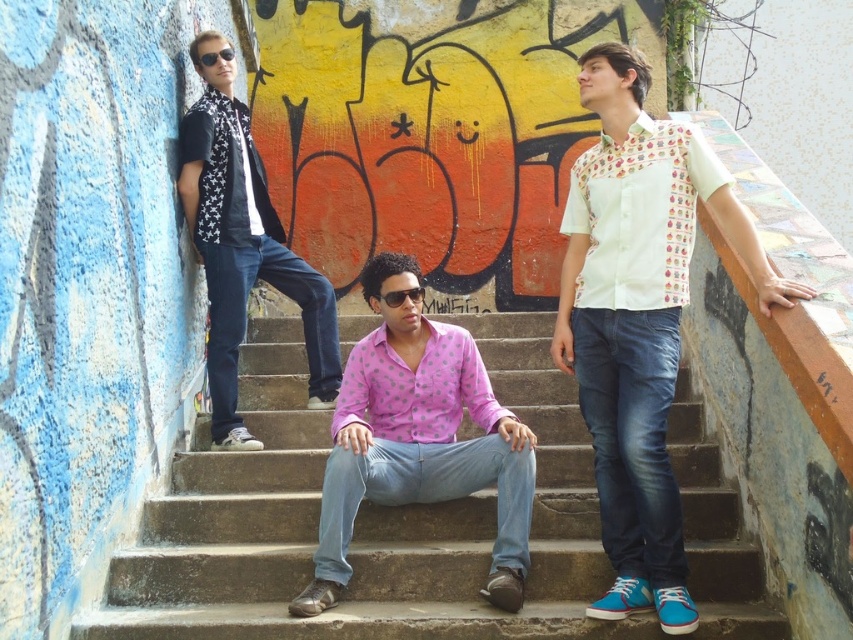
You are taking a photo of the scene and want to ensure both the white printed shirt at right and the matte black scarf at left are in focus. Which object should you adjust your camera focus on first to ensure both are sharp?

The white printed shirt at right is closer to the viewer than the matte black scarf at left. To ensure both are in focus, you should focus on the matte black scarf at left first, as it is farther away, allowing the depth of field to cover both objects.